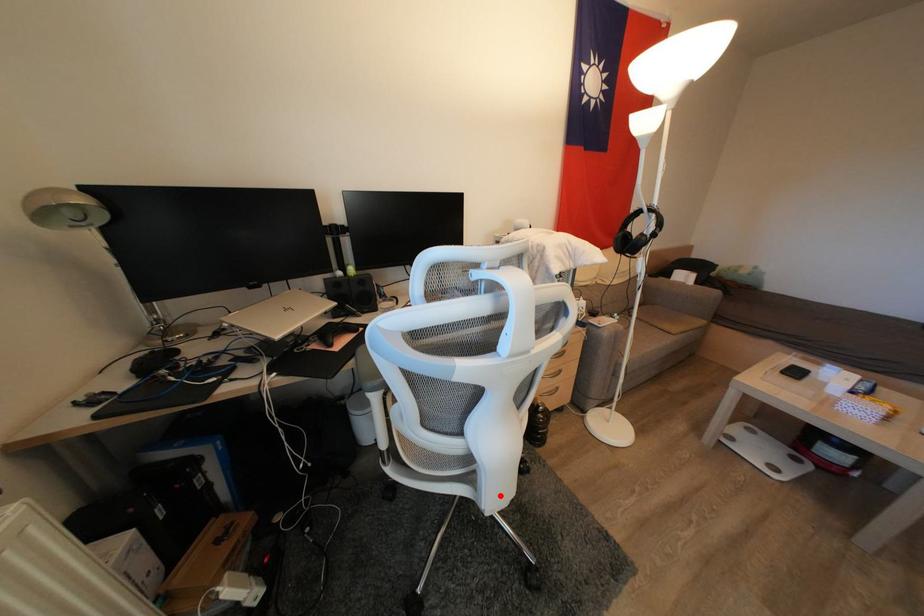
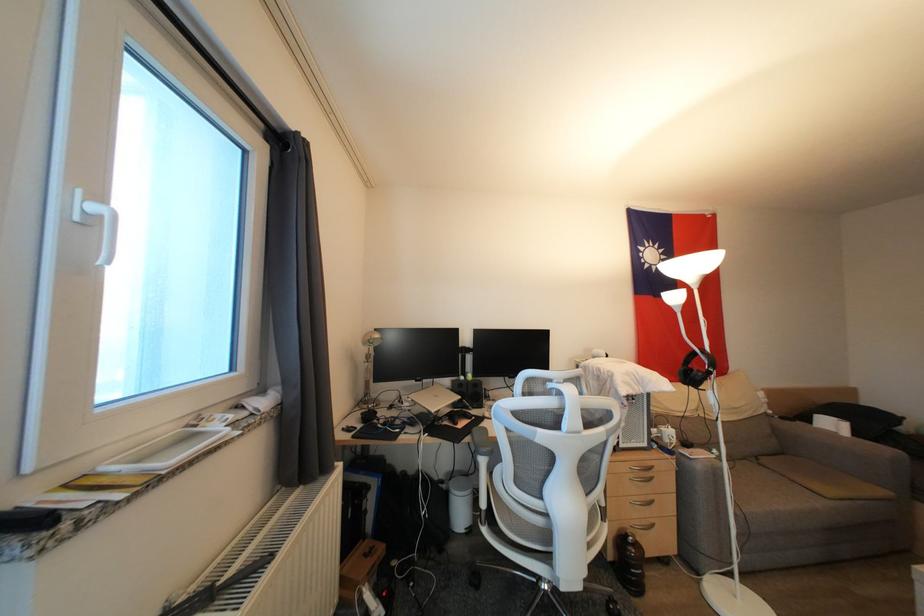
Find the pixel in the second image that matches the highlighted location in the first image.

(574, 573)